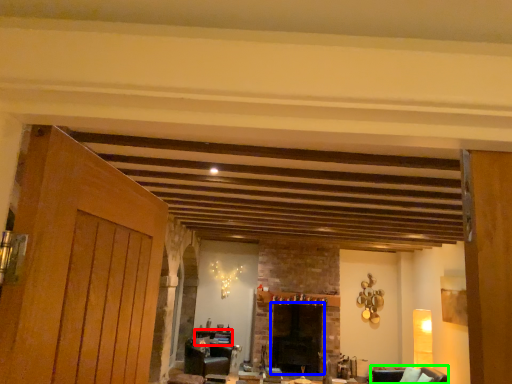
Question: Estimate the real-world distances between objects in this image. Which object is farther from table (highlighted by a red box), fireplace (highlighted by a blue box) or armchair (highlighted by a green box)?

Choices:
 (A) fireplace
 (B) armchair

Answer: (B)